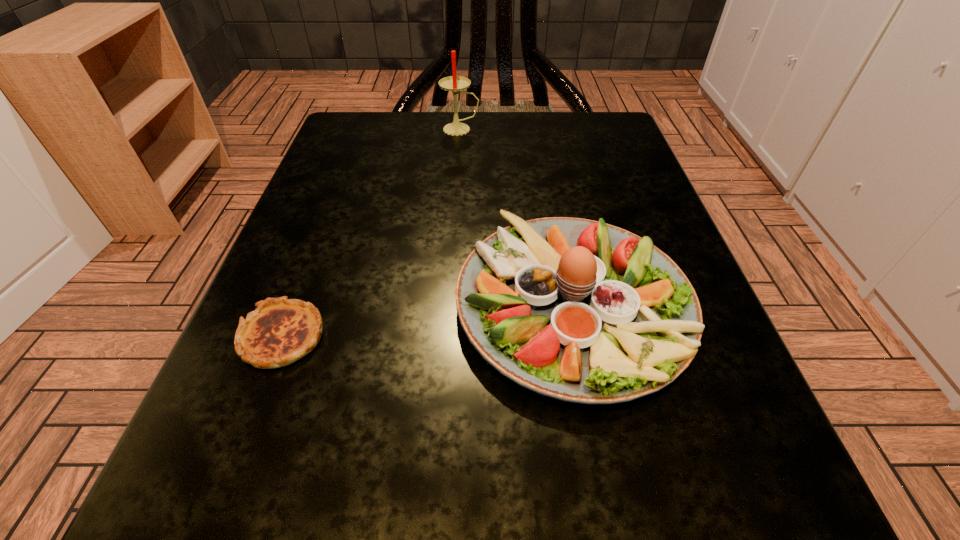
This screenshot has height=540, width=960. Find the location of `the farthest object`. the farthest object is located at coordinates (453, 83).

You are a GUI agent. You are given a task and a screenshot of the screen. Output one action in this format:
    pyautogui.click(x=<x>, y=<y>)
    Task: Click on the candle
    The height and width of the screenshot is (540, 960).
    Given the screenshot: What is the action you would take?
    pyautogui.click(x=453, y=83)

Identify the location of salad plate. The height and width of the screenshot is (540, 960). (578, 310).

Find the location of a particular element. The width and height of the screenshot is (960, 540). quiche is located at coordinates (280, 331).

Find the location of a particular element. Image resolution: width=960 pixels, height=540 pixels. the shortest object is located at coordinates coord(280,331).

I want to click on vacant space located 0.150m on the right of the farthest object, so click(x=553, y=130).

Find the location of `vacant space situated on the left of the salad plate`. vacant space situated on the left of the salad plate is located at coordinates (364, 305).

At what (x,y) coordinates should I click in order to perform the action: click on vacant space located on the right of the shortest object. Please return your answer as a coordinate pair (x, y). The image size is (960, 540). Looking at the image, I should click on (578, 336).

The height and width of the screenshot is (540, 960). What are the coordinates of `object that is at the far edge` in the screenshot? It's located at (453, 83).

Identify the location of object that is at the left edge. Image resolution: width=960 pixels, height=540 pixels. (280, 331).